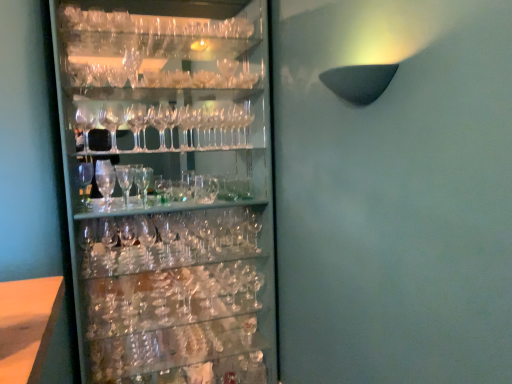
Describe the element at coordinates (143, 182) in the screenshot. I see `clear glass beer glass at center` at that location.

Locate an element on the screen. This screenshot has height=384, width=512. clear glass wine glass at upper center is located at coordinates (228, 71).

Can you confirm if clear glass wine glasses at left is bigger than clear glass wine glass at upper center?

Correct, clear glass wine glasses at left is larger in size than clear glass wine glass at upper center.

How different are the orientations of clear glass wine glasses at left and clear glass wine glass at upper center in degrees?

They differ by 0.515 degrees in their facing directions.

Could clear glass wine glass at upper center be considered to be inside clear glass wine glasses at left?

Yes, clear glass wine glasses at left contains clear glass wine glass at upper center.

Between clear glass wine glasses at left and clear glass wine glass at upper center, which one appears on the left side from the viewer's perspective?

From the viewer's perspective, clear glass wine glasses at left appears more on the left side.

Considering the sizes of objects clear glass wine glass at upper center and clear glass beer glass at center in the image provided, who is thinner, clear glass wine glass at upper center or clear glass beer glass at center?

Thinner between the two is clear glass wine glass at upper center.

From the image's perspective, which object appears higher, clear glass wine glass at upper center or clear glass beer glass at center?

clear glass wine glass at upper center is shown above in the image.

From a real-world perspective, is clear glass wine glass at upper center beneath clear glass beer glass at center?

No.

From the image's perspective, which is below, clear glass wine glasses at left or clear glass beer glass at center?

clear glass wine glasses at left.

Between clear glass wine glasses at left and clear glass beer glass at center, which one appears on the right side from the viewer's perspective?

Positioned to the right is clear glass wine glasses at left.

Is clear glass wine glasses at left next to clear glass beer glass at center and touching it?

clear glass wine glasses at left and clear glass beer glass at center are not in contact.

Looking at the image, does clear glass wine glasses at left seem bigger or smaller compared to clear glass beer glass at center?

In the image, clear glass wine glasses at left appears to be larger than clear glass beer glass at center.

Is clear glass beer glass at center turned away from clear glass wine glass at upper center?

clear glass beer glass at center does not have its back to clear glass wine glass at upper center.

Is point (142, 178) more distant than point (217, 66)?

No, (142, 178) is closer to viewer.

From the image's perspective, is clear glass beer glass at center above or below clear glass wine glass at upper center?

Based on their image positions, clear glass beer glass at center is located beneath clear glass wine glass at upper center.

Is clear glass beer glass at center positioned far away from clear glass wine glass at upper center?

No, clear glass beer glass at center is not far away from clear glass wine glass at upper center.

From a real-world perspective, is clear glass wine glass at upper center positioned above or below clear glass wine glasses at left?

clear glass wine glass at upper center is situated higher than clear glass wine glasses at left in the real world.

How far apart are clear glass wine glass at upper center and clear glass wine glasses at left?

72.03 centimeters.

Which object is positioned more to the left, clear glass wine glass at upper center or clear glass wine glasses at left?

From the viewer's perspective, clear glass wine glasses at left appears more on the left side.

Is clear glass wine glass at upper center outside of clear glass wine glasses at left?

That's incorrect, clear glass wine glass at upper center is not completely outside clear glass wine glasses at left.

Is clear glass beer glass at center oriented away from clear glass wine glasses at left?

Yes.

Looking at their sizes, would you say clear glass beer glass at center is wider or thinner than clear glass wine glasses at left?

clear glass beer glass at center is thinner than clear glass wine glasses at left.

Image resolution: width=512 pixels, height=384 pixels. I want to click on beer glass positioned vertically above the clear glass wine glasses at left (from a real-world perspective), so pos(143,182).

Locate an element on the screen. This screenshot has width=512, height=384. wine glass above the clear glass wine glasses at left (from the image's perspective) is located at coordinates (x=228, y=71).

This screenshot has height=384, width=512. I want to click on wine glass behind the clear glass beer glass at center, so (228, 71).

Considering their positions, is clear glass wine glasses at left positioned further to clear glass wine glass at upper center than clear glass beer glass at center?

Based on the image, clear glass wine glasses at left appears to be further to clear glass wine glass at upper center.

Which object lies nearer to the anchor point clear glass beer glass at center, clear glass wine glass at upper center or clear glass wine glasses at left?

clear glass wine glasses at left is positioned closer to the anchor clear glass beer glass at center.

Based on the photo, considering their positions, is clear glass wine glasses at left positioned further to clear glass beer glass at center than clear glass wine glass at upper center?

clear glass wine glass at upper center is positioned further to the anchor clear glass beer glass at center.

Looking at the image, which one is located further to clear glass wine glasses at left, clear glass beer glass at center or clear glass wine glass at upper center?

Among the two, clear glass wine glass at upper center is located further to clear glass wine glasses at left.

Based on their spatial positions, is clear glass beer glass at center or clear glass wine glasses at left further from clear glass wine glass at upper center?

clear glass wine glasses at left is positioned further to the anchor clear glass wine glass at upper center.

Looking at the image, which one is located further to clear glass wine glasses at left, clear glass wine glass at upper center or clear glass beer glass at center?

clear glass wine glass at upper center is positioned further to the anchor clear glass wine glasses at left.

The height and width of the screenshot is (384, 512). I want to click on beer glass between clear glass wine glass at upper center and clear glass wine glasses at left in the up-down direction, so click(143, 182).